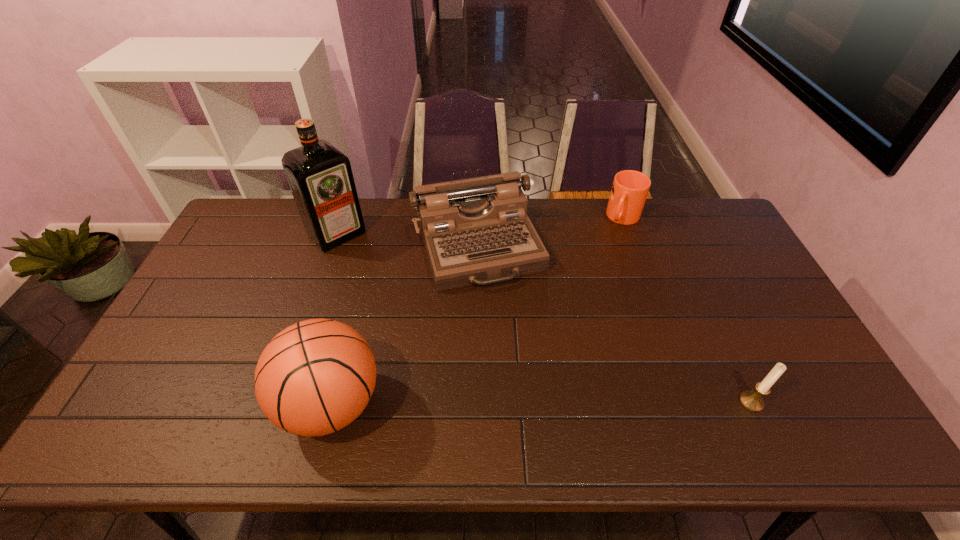
The image size is (960, 540). Identify the location of vacant space that is in between the mug and the candle holder. (687, 310).

Identify the location of free space between the basketball and the rightmost object. The width and height of the screenshot is (960, 540). (541, 403).

You are a GUI agent. You are given a task and a screenshot of the screen. Output one action in this format:
    pyautogui.click(x=<x>, y=<y>)
    Task: Click on the free space between the liquor and the basketball
    The height and width of the screenshot is (540, 960).
    Given the screenshot: What is the action you would take?
    pyautogui.click(x=334, y=319)

Identify the location of vacant space that's between the typewriter and the tallest object. Image resolution: width=960 pixels, height=540 pixels. (407, 240).

What are the coordinates of `free space that is in between the rightmost object and the fourth shortest object` in the screenshot? It's located at (541, 403).

Where is `free space between the tallest object and the basketball`? The width and height of the screenshot is (960, 540). free space between the tallest object and the basketball is located at coordinates (334, 319).

Identify which object is the fourth nearest to the basketball. Please provide its 2D coordinates. Your answer should be formatted as a tuple, i.e. [(x, y)], where the tuple contains the x and y coordinates of a point satisfying the conditions above.

[(751, 400)]

Choose which object is the fourth nearest neighbor to the mug. Please provide its 2D coordinates. Your answer should be formatted as a tuple, i.e. [(x, y)], where the tuple contains the x and y coordinates of a point satisfying the conditions above.

[(315, 377)]